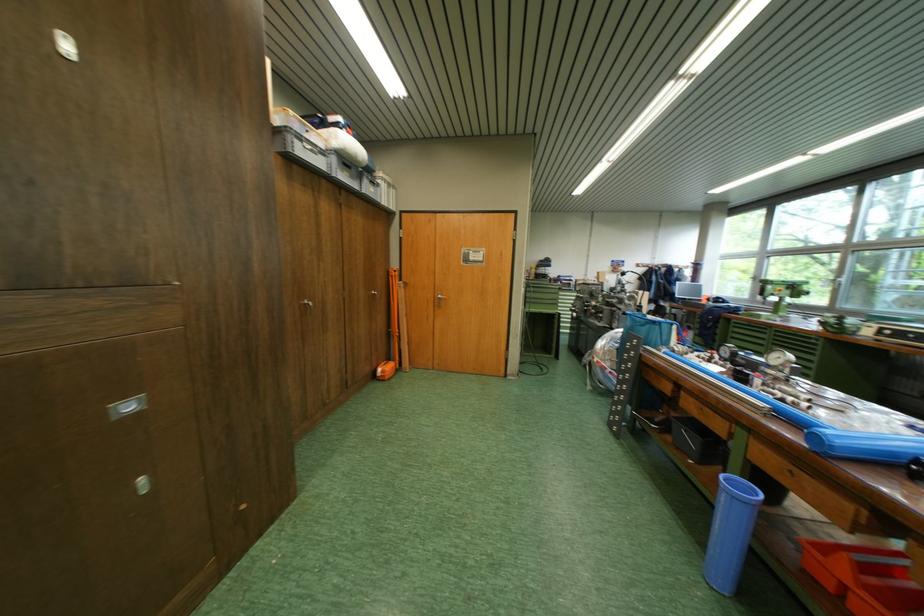
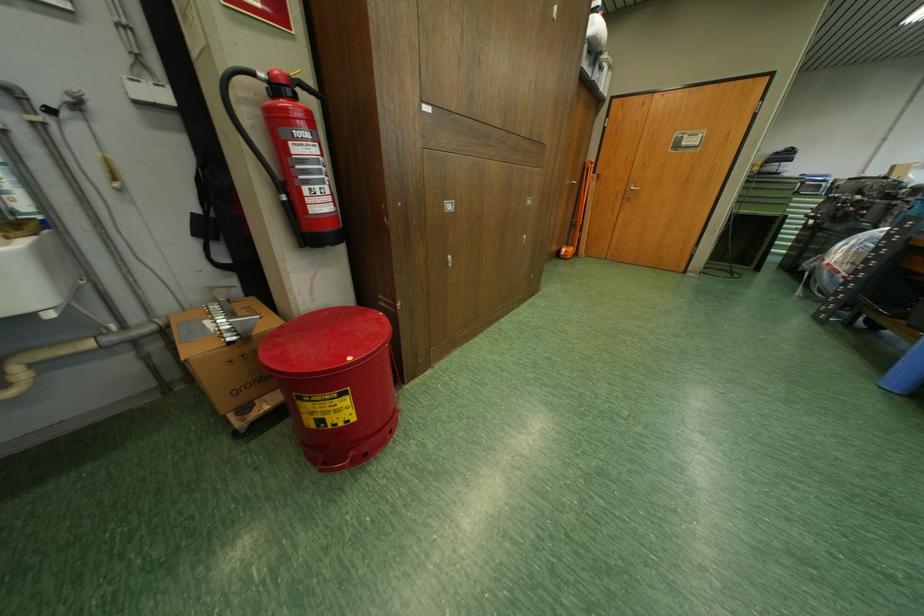
Locate, in the second image, the point that corresponds to point (385, 296) in the first image.

(585, 185)